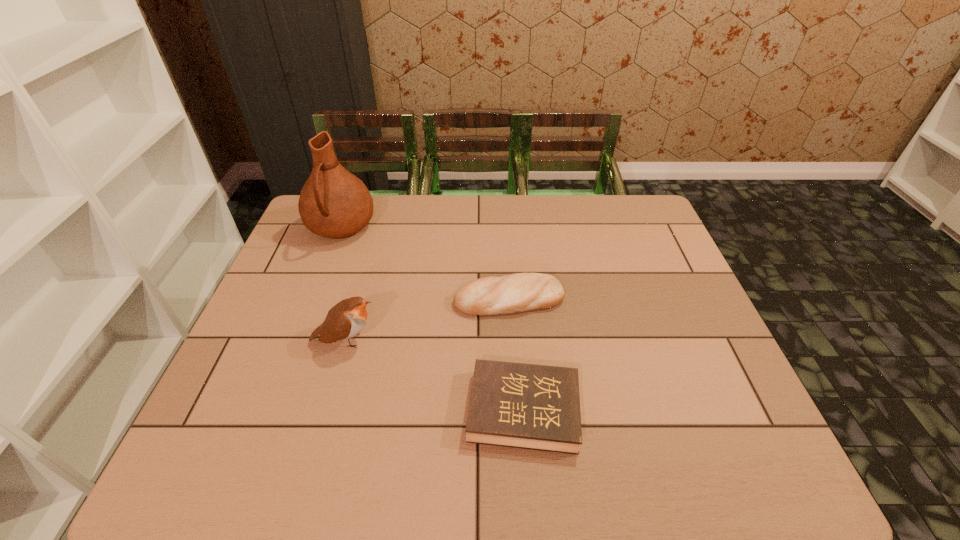
In the image, there is a desktop. Where is `vacant area at the near left corner`? The width and height of the screenshot is (960, 540). vacant area at the near left corner is located at coordinates (227, 437).

Where is `free location at the far right corner of the desktop`? free location at the far right corner of the desktop is located at coordinates (647, 231).

What are the coordinates of `vacant space at the near right corner of the desktop` in the screenshot? It's located at (737, 444).

Identify the location of unoccupied position between the third farthest object and the pitcher. (344, 284).

This screenshot has width=960, height=540. Identify the location of vacant region between the bread and the shortest object. (516, 355).

Locate an element on the screen. This screenshot has height=540, width=960. vacant area that lies between the nearest object and the second nearest object is located at coordinates (434, 375).

Where is `vacant space that's between the third farthest object and the third nearest object`? Image resolution: width=960 pixels, height=540 pixels. vacant space that's between the third farthest object and the third nearest object is located at coordinates (427, 320).

Locate an element on the screen. The image size is (960, 540). free space that is in between the nearest object and the second farthest object is located at coordinates (516, 355).

This screenshot has width=960, height=540. In order to click on vacant area that lies between the hardback book and the bird in this screenshot , I will do `click(434, 375)`.

At what (x,y) coordinates should I click in order to perform the action: click on free area in between the second tallest object and the second shortest object. Please return your answer as a coordinate pair (x, y). Looking at the image, I should click on pyautogui.click(x=427, y=320).